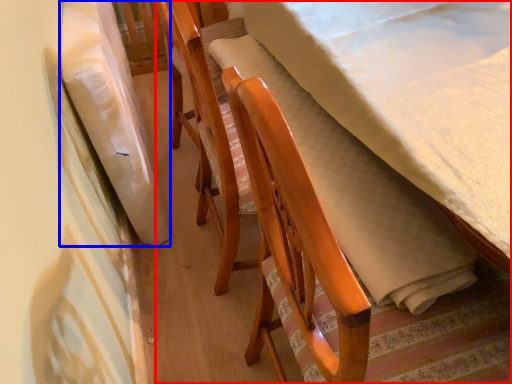
Question: Which point is further to the camera, furniture (highlighted by a red box) or blanket (highlighted by a blue box)?

Choices:
 (A) furniture
 (B) blanket

Answer: (B)